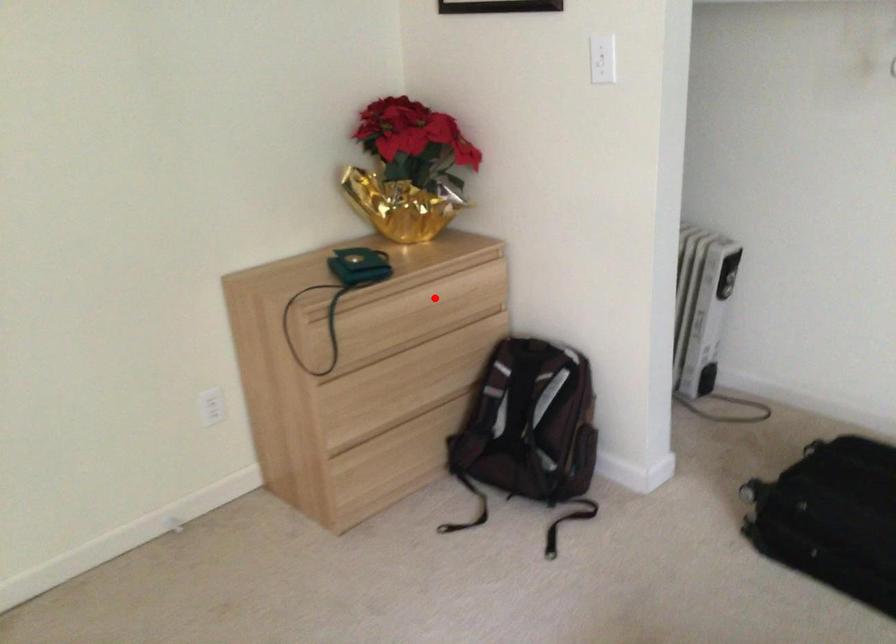
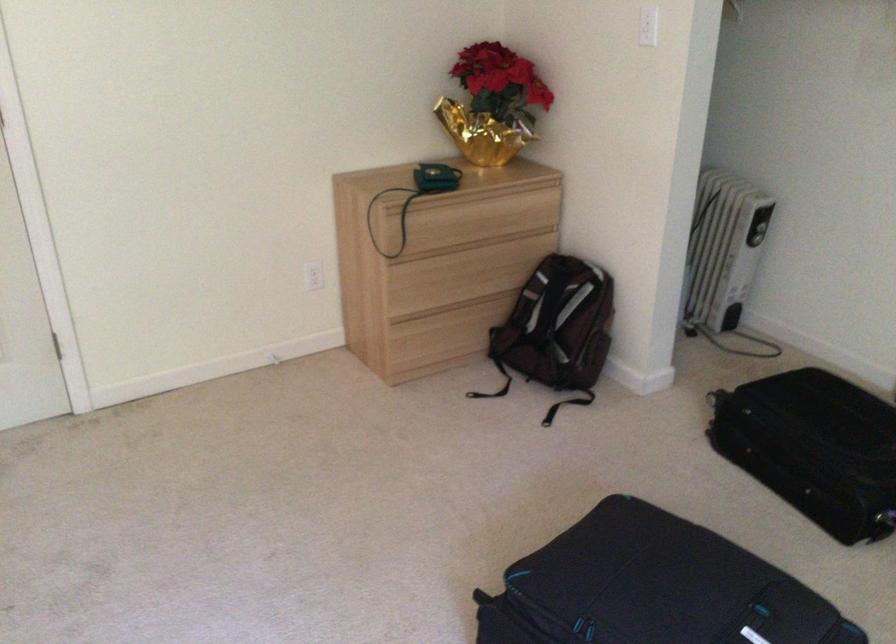
Question: A red point is marked in image1. In image2, is the corresponding 3D point closer to the camera or farther? Reply with the corresponding letter.

Choices:
 (A) The corresponding 3D point is closer.
 (B) The corresponding 3D point is farther.

Answer: (B)